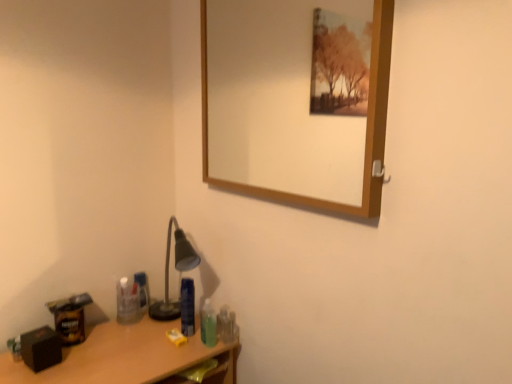
Question: Is translucent plastic toothbrush at lower right, the 2th toiletry positioned from the front, completely or partially inside wooden desk at lower left?

Choices:
 (A) yes
 (B) no

Answer: (B)

Question: From a real-world perspective, is wooden desk at lower left on top of translucent plastic toothbrush at lower right, the 2th toiletry positioned from the front?

Choices:
 (A) no
 (B) yes

Answer: (A)

Question: Considering the relative sizes of wooden desk at lower left and translucent plastic toothbrush at lower right, which appears as the fourth toiletry when viewed from the left, in the image provided, is wooden desk at lower left thinner than translucent plastic toothbrush at lower right, which appears as the fourth toiletry when viewed from the left,?

Choices:
 (A) yes
 (B) no

Answer: (B)

Question: Can you confirm if wooden desk at lower left is positioned to the right of translucent plastic toothbrush at lower right, which is counted as the 3th toiletry, starting from the back?

Choices:
 (A) no
 (B) yes

Answer: (A)

Question: Is wooden desk at lower left positioned far away from translucent plastic toothbrush at lower right, which appears as the fourth toiletry when viewed from the left?

Choices:
 (A) no
 (B) yes

Answer: (A)

Question: Considering the relative sizes of wooden desk at lower left and translucent plastic toothbrush at lower right, the first toiletry from the right, in the image provided, is wooden desk at lower left shorter than translucent plastic toothbrush at lower right, the first toiletry from the right,?

Choices:
 (A) yes
 (B) no

Answer: (B)

Question: Is wooden-framed mirror at upper center touching translucent plastic bottle at lower center, the 3th toiletry positioned from the left?

Choices:
 (A) yes
 (B) no

Answer: (B)

Question: Can translucent plastic bottle at lower center, which is counted as the fourth toiletry, starting from the back, be found inside wooden-framed mirror at upper center?

Choices:
 (A) no
 (B) yes

Answer: (A)

Question: Can you confirm if wooden-framed mirror at upper center is bigger than translucent plastic bottle at lower center, which appears as the 2th toiletry when viewed from the right?

Choices:
 (A) yes
 (B) no

Answer: (A)

Question: Does wooden-framed mirror at upper center have a lesser width compared to translucent plastic bottle at lower center, which appears as the 2th toiletry when viewed from the right?

Choices:
 (A) no
 (B) yes

Answer: (B)

Question: Can you confirm if wooden-framed mirror at upper center is positioned to the right of translucent plastic bottle at lower center, the first toiletry from the front?

Choices:
 (A) no
 (B) yes

Answer: (B)

Question: Is wooden-framed mirror at upper center positioned beyond the bounds of translucent plastic bottle at lower center, the first toiletry from the front?

Choices:
 (A) no
 (B) yes

Answer: (B)

Question: Is blue plastic bottle at lower center, the 3th toiletry positioned from the front, not near translucent plastic toothbrush at lower right, which is counted as the 3th toiletry, starting from the back?

Choices:
 (A) no
 (B) yes

Answer: (A)